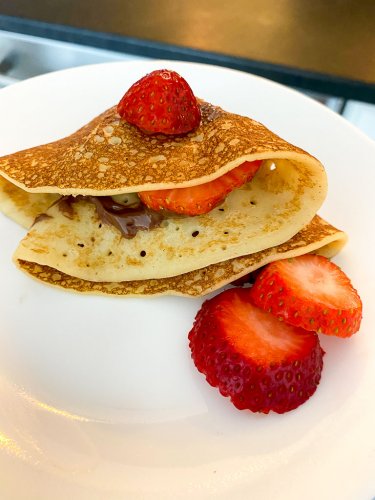
Identify the location of plate. (159, 370).